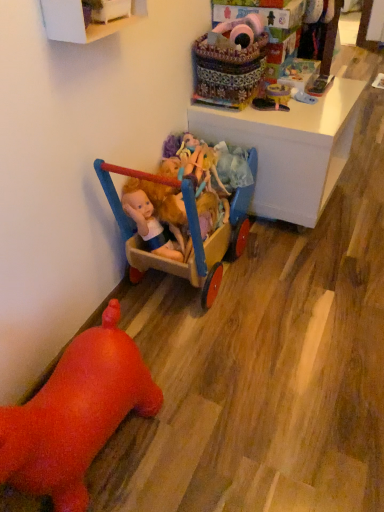
Find the location of a particular element. vacant space to the right of wooden cart at center, which is counted as the 5th toy, starting from the top is located at coordinates (310, 277).